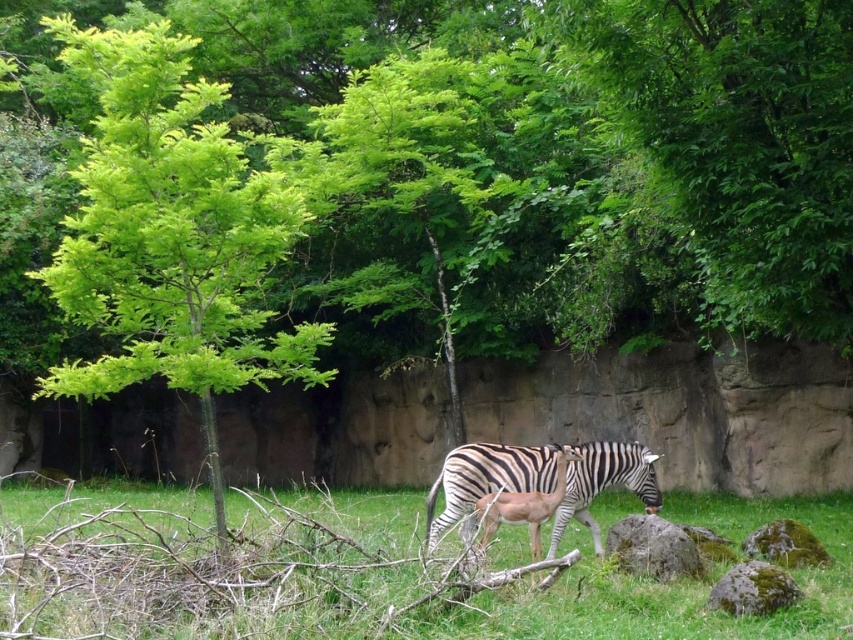
Who is positioned more to the left, green grass at center or green mossy rock at lower right?

green grass at center

Does green grass at center have a larger size compared to green mossy rock at lower right?

Yes.

Locate an element on the screen. The image size is (853, 640). green grass at center is located at coordinates (364, 572).

Locate an element on the screen. The image size is (853, 640). green grass at center is located at coordinates (364, 572).

Can you confirm if smooth gray rock at center is bigger than green mossy rock at lower right?

Yes.

What do you see at coordinates (653, 547) in the screenshot?
I see `smooth gray rock at center` at bounding box center [653, 547].

Between point (625, 522) and point (772, 564), which one is positioned behind?

The point (625, 522) is more distant.

Identify the location of smooth gray rock at center. The width and height of the screenshot is (853, 640). (653, 547).

Does green grass at center come in front of black and white striped zebra at center?

Yes.

Does point (840, 531) lie in front of point (582, 476)?

No.

Locate an element on the screen. This screenshot has height=640, width=853. green grass at center is located at coordinates (364, 572).